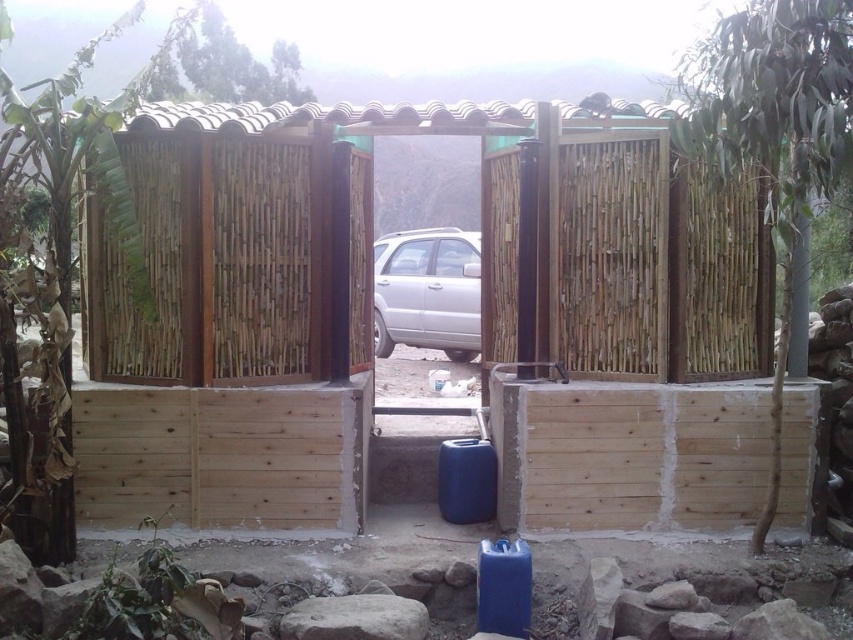
Question: Among these objects, which one is nearest to the camera?

Choices:
 (A) satin silver car at center
 (B) natural wood fence at center

Answer: (B)

Question: Is natural wood fence at center bigger than satin silver car at center?

Choices:
 (A) no
 (B) yes

Answer: (B)

Question: From the image, what is the correct spatial relationship of natural wood fence at center in relation to satin silver car at center?

Choices:
 (A) above
 (B) below

Answer: (B)

Question: Which of the following is the farthest from the observer?

Choices:
 (A) natural wood fence at center
 (B) satin silver car at center

Answer: (B)

Question: Is natural wood fence at center thinner than satin silver car at center?

Choices:
 (A) yes
 (B) no

Answer: (B)

Question: Which point is closer to the camera?

Choices:
 (A) satin silver car at center
 (B) natural wood fence at center

Answer: (B)